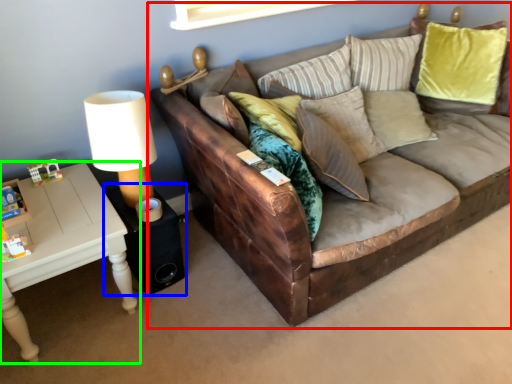
Question: Based on their relative distances, which object is nearer to studio couch (highlighted by a red box)? Choose from side table (highlighted by a blue box) and table (highlighted by a green box).

Choices:
 (A) side table
 (B) table

Answer: (A)